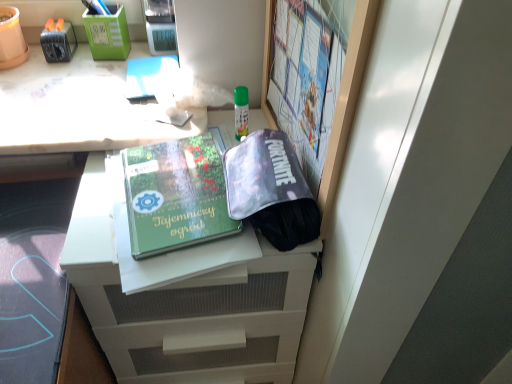
This screenshot has width=512, height=384. Identify the location of vacant region in front of matte black tape dispenser at upper left, which ranks as the 2th stationery in right-to-left order. (51, 87).